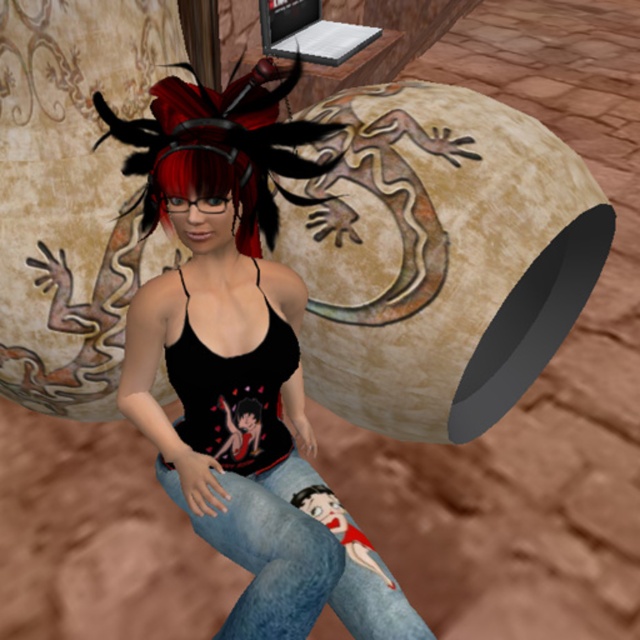
What are the coordinates of the matte black tank top at center in the image?

The coordinates of the matte black tank top at center are at point (241,362).

You are a fashion designer examining the character in the image. You need to determine the spatial relationship between the matte black tank top at center and the denim jeans at center. Which clothing item is positioned higher on the character?

The matte black tank top at center is located above the denim jeans at center, so it is positioned higher on the character.

Based on the scene description, which object is larger in size between the matte black tank top at center and the denim jeans at center?

The matte black tank top at center is bigger than the denim jeans at center according to the description.